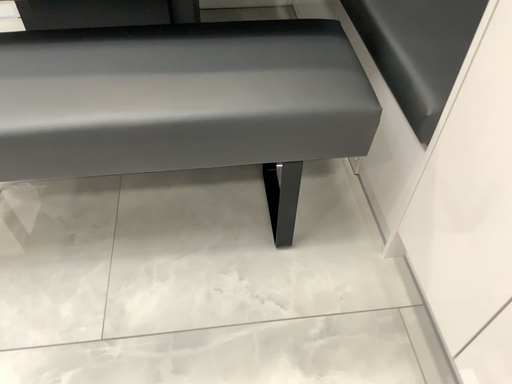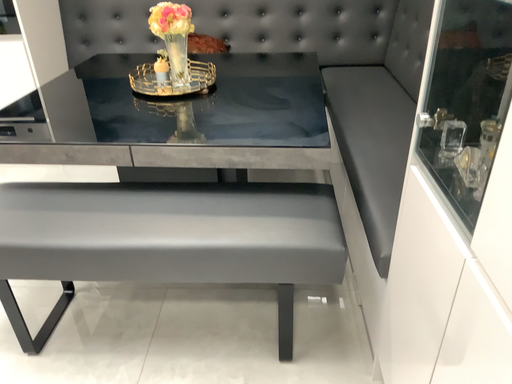
Question: How did the camera likely rotate when shooting the video?

Choices:
 (A) rotated upward
 (B) rotated downward

Answer: (A)